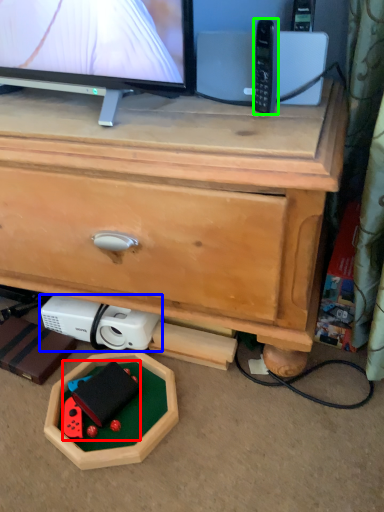
Question: Which object is positioned closest to toy (highlighted by a red box)? Select from appliance (highlighted by a blue box) and control (highlighted by a green box).

Choices:
 (A) appliance
 (B) control

Answer: (A)